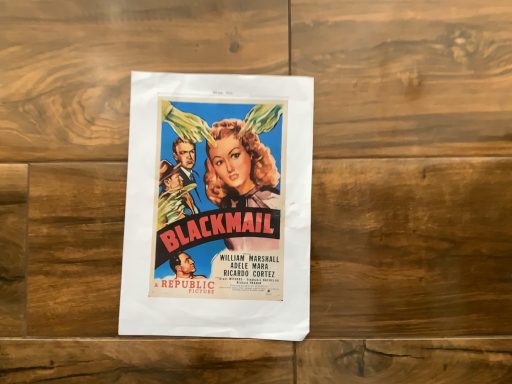
Question: Should I look upward or downward to see matte paper poster at center?

Choices:
 (A) down
 (B) up

Answer: (A)